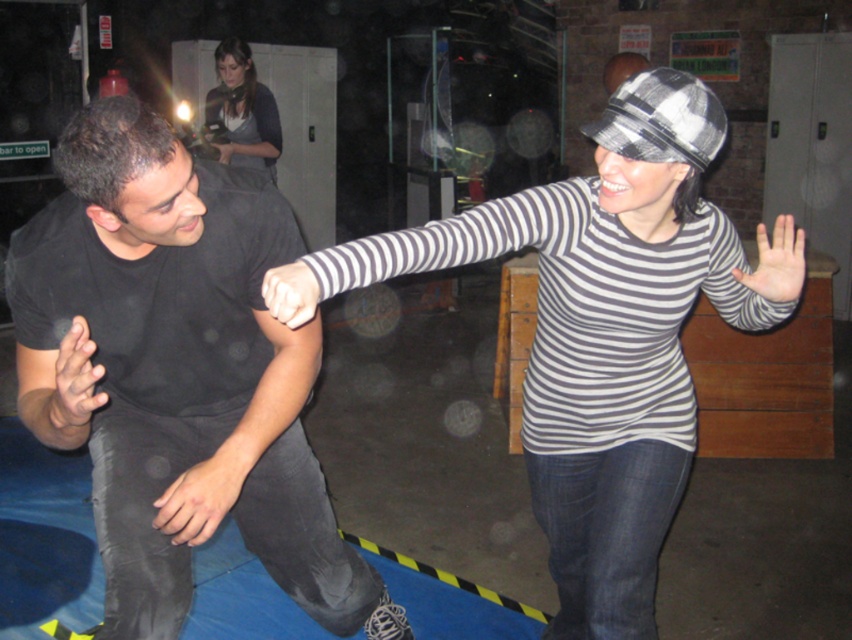
Is black matte shirt at left wider than matte gray sweater at upper center?

Indeed, black matte shirt at left has a greater width compared to matte gray sweater at upper center.

Between point (105, 422) and point (235, 104), which one is positioned in front?

Positioned in front is point (105, 422).

You are a GUI agent. You are given a task and a screenshot of the screen. Output one action in this format:
    pyautogui.click(x=<x>, y=<y>)
    Task: Click on the black matte shirt at left
    
    Given the screenshot: What is the action you would take?
    pyautogui.click(x=177, y=372)

Locate an element on the screen. This screenshot has width=852, height=640. black matte shirt at left is located at coordinates (177, 372).

Is black matte shirt at left smaller than striped cotton shirt at center?

Yes.

Which is in front, point (140, 531) or point (534, 508)?

Point (140, 531) is in front.

The height and width of the screenshot is (640, 852). Find the location of `black matte shirt at left`. black matte shirt at left is located at coordinates (177, 372).

Measure the distance between striped cotton shirt at center and camera.

striped cotton shirt at center and camera are 4.21 feet apart.

Can you confirm if striped cotton shirt at center is thinner than matte gray sweater at upper center?

Incorrect, striped cotton shirt at center's width is not less than matte gray sweater at upper center's.

Between point (540, 260) and point (240, 86), which one is positioned in front?

Point (540, 260)

At what (x,y) coordinates should I click in order to perform the action: click on striped cotton shirt at center. Please return your answer as a coordinate pair (x, y). Looking at the image, I should click on (599, 332).